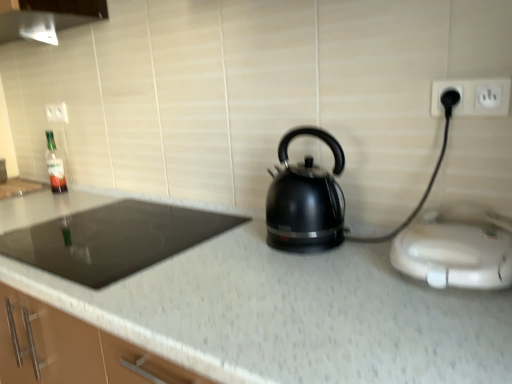
Image resolution: width=512 pixels, height=384 pixels. What are the coordinates of `free space in front of black glossy kettle at center` in the screenshot? It's located at (x=294, y=276).